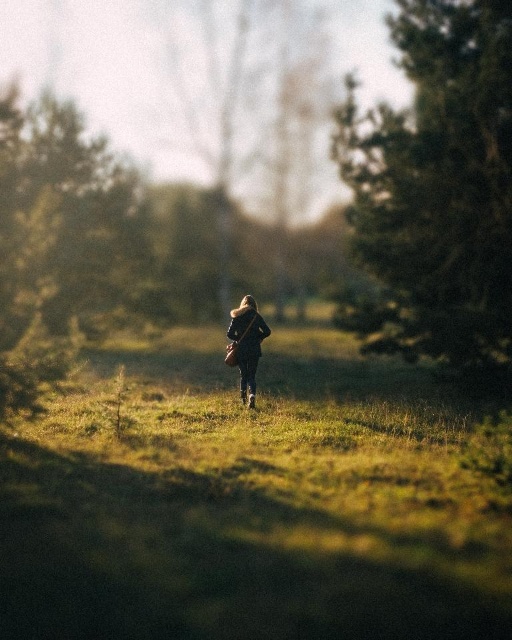
Is green textured tree at right shorter than green textured tree at left?

No.

Is point (496, 129) positioned before point (77, 124)?

Yes, point (496, 129) is closer to viewer.

The image size is (512, 640). In order to click on green textured tree at right in this screenshot , I will do `click(436, 189)`.

Is green grass at center to the left of green textured tree at left from the viewer's perspective?

In fact, green grass at center is to the right of green textured tree at left.

Can you confirm if green grass at center is thinner than green textured tree at left?

Correct, green grass at center's width is less than green textured tree at left's.

This screenshot has height=640, width=512. What do you see at coordinates (248, 500) in the screenshot?
I see `green grass at center` at bounding box center [248, 500].

Where is `green grass at center`? green grass at center is located at coordinates (248, 500).

Does green textured tree at right have a larger size compared to dark brown leather jacket at center?

Yes.

Is point (457, 102) more distant than point (233, 330)?

No, it is not.

The height and width of the screenshot is (640, 512). Find the location of `green textured tree at right`. green textured tree at right is located at coordinates (436, 189).